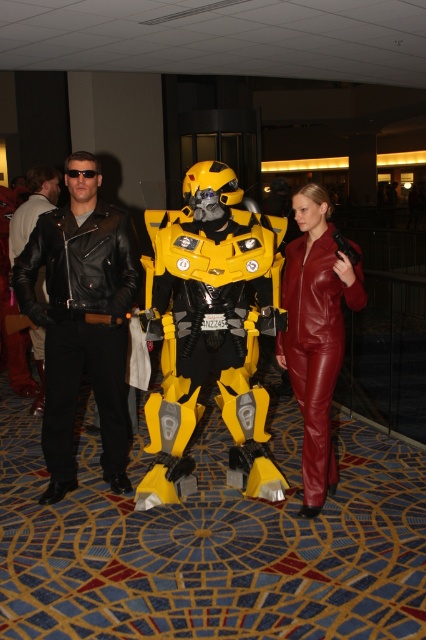
Question: Based on their relative distances, which object is nearer to the black leather jacket at left?

Choices:
 (A) leather jacket at left
 (B) leather suit at center

Answer: (A)

Question: Is yellow matte robot at center above black leather jacket at left?

Choices:
 (A) yes
 (B) no

Answer: (B)

Question: Which point is farther to the camera?

Choices:
 (A) (49, 180)
 (B) (215, 355)
 (C) (54, 300)
 (D) (305, 424)

Answer: (A)

Question: Where is black leather jacket at left located in relation to leather suit at center in the image?

Choices:
 (A) right
 (B) left

Answer: (B)

Question: Which object appears farthest from the camera in this image?

Choices:
 (A) leather suit at center
 (B) leather jacket at left

Answer: (B)

Question: Is yellow matte robot at center thinner than leather jacket at left?

Choices:
 (A) yes
 (B) no

Answer: (B)